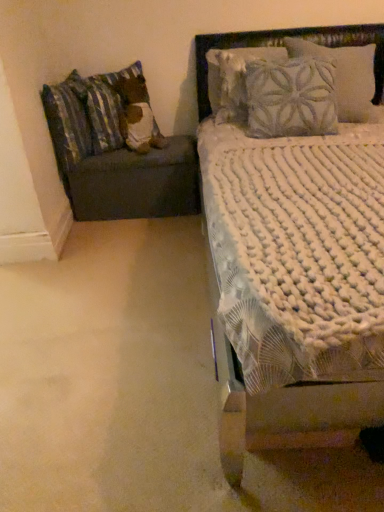
Identify the location of dark gray fabric ottoman at left. The image size is (384, 512). click(137, 183).

This screenshot has height=512, width=384. I want to click on striped fabric pillow at left, placed as the 2th pillow when sorted from right to left, so click(68, 121).

Image resolution: width=384 pixels, height=512 pixels. Find the location of `fluffy fabric pillow at left, which is counted as the second pillow, starting from the left`. fluffy fabric pillow at left, which is counted as the second pillow, starting from the left is located at coordinates (138, 116).

What do you see at coordinates (138, 116) in the screenshot? The width and height of the screenshot is (384, 512). I see `fluffy fabric pillow at left, which is counted as the second pillow, starting from the left` at bounding box center [138, 116].

Locate an element on the screen. The height and width of the screenshot is (512, 384). white textured bed at upper right is located at coordinates (282, 45).

Image resolution: width=384 pixels, height=512 pixels. What are the coordinates of `dark gray fabric ottoman at left` in the screenshot? It's located at (137, 183).

Is striped fabric pillow at left, the 1th pillow positioned from the left, at the back of fluffy fabric headboard at upper right?

No, fluffy fabric headboard at upper right is not facing the opposite direction of striped fabric pillow at left, the 1th pillow positioned from the left.

Who is more distant, fluffy fabric headboard at upper right or striped fabric pillow at left, placed as the 2th pillow when sorted from right to left?

Positioned behind is fluffy fabric headboard at upper right.

From the image's perspective, is fluffy fabric headboard at upper right on top of striped fabric pillow at left, the 1th pillow positioned from the left?

Yes, from the image's perspective, fluffy fabric headboard at upper right is over striped fabric pillow at left, the 1th pillow positioned from the left.

What's the angular difference between white textured bed at upper right and fluffy fabric pillow at left, which is counted as the second pillow, starting from the left,'s facing directions?

white textured bed at upper right and fluffy fabric pillow at left, which is counted as the second pillow, starting from the left, are facing 37.1 degrees away from each other.

Which object is further away from the camera, white textured bed at upper right or fluffy fabric pillow at left, which is counted as the second pillow, starting from the left?

fluffy fabric pillow at left, which is counted as the second pillow, starting from the left, is further away from the camera.

From a real-world perspective, which object stands above the other?

From a 3D spatial view, fluffy fabric pillow at left, the 1th pillow positioned from the right, is above.

At what (x,y) coordinates should I click in order to perform the action: click on table below the striped fabric pillow at left, placed as the 2th pillow when sorted from right to left (from the image's perspective). Please return your answer as a coordinate pair (x, y). The image size is (384, 512). Looking at the image, I should click on (137, 183).

Can you confirm if dark gray fabric ottoman at left is thinner than striped fabric pillow at left, the 1th pillow positioned from the left?

Incorrect, the width of dark gray fabric ottoman at left is not less than that of striped fabric pillow at left, the 1th pillow positioned from the left.

How many degrees apart are the facing directions of dark gray fabric ottoman at left and striped fabric pillow at left, the 1th pillow positioned from the left?

The facing directions of dark gray fabric ottoman at left and striped fabric pillow at left, the 1th pillow positioned from the left, are 79.7 degrees apart.

From the image's perspective, relative to striped fabric pillow at left, placed as the 2th pillow when sorted from right to left, is dark gray fabric ottoman at left above or below?

Clearly, from the image's perspective, dark gray fabric ottoman at left is below striped fabric pillow at left, placed as the 2th pillow when sorted from right to left.

The width and height of the screenshot is (384, 512). I want to click on pillow behind the striped fabric pillow at left, the 1th pillow positioned from the left, so click(x=138, y=116).

Measure the distance between fluffy fabric pillow at left, which is counted as the second pillow, starting from the left, and striped fabric pillow at left, placed as the 2th pillow when sorted from right to left.

fluffy fabric pillow at left, which is counted as the second pillow, starting from the left, is 11.36 inches from striped fabric pillow at left, placed as the 2th pillow when sorted from right to left.

Could you tell me if fluffy fabric pillow at left, which is counted as the second pillow, starting from the left, is turned towards striped fabric pillow at left, placed as the 2th pillow when sorted from right to left?

No, fluffy fabric pillow at left, which is counted as the second pillow, starting from the left, is not oriented towards striped fabric pillow at left, placed as the 2th pillow when sorted from right to left.

From the image's perspective, does fluffy fabric pillow at left, the 1th pillow positioned from the right, appear higher than striped fabric pillow at left, the 1th pillow positioned from the left?

Yes.

Is white textured bed at upper right at the back of striped fabric pillow at left, placed as the 2th pillow when sorted from right to left?

No, striped fabric pillow at left, placed as the 2th pillow when sorted from right to left, is not facing the opposite direction of white textured bed at upper right.

Which is further, (53, 94) or (295, 396)?

Positioned behind is point (53, 94).

Which of these two, striped fabric pillow at left, placed as the 2th pillow when sorted from right to left, or white textured bed at upper right, is bigger?

Bigger between the two is white textured bed at upper right.

Is dark gray fabric ottoman at left inside or outside of white textured bed at upper right?

dark gray fabric ottoman at left is located beyond the bounds of white textured bed at upper right.

Considering the positions of objects dark gray fabric ottoman at left and white textured bed at upper right in the image provided, who is behind, dark gray fabric ottoman at left or white textured bed at upper right?

dark gray fabric ottoman at left is further from the camera.

Based on the photo, considering the positions of objects dark gray fabric ottoman at left and white textured bed at upper right in the image provided, who is more to the left, dark gray fabric ottoman at left or white textured bed at upper right?

Positioned to the left is dark gray fabric ottoman at left.

From the picture: What's the angular difference between dark gray fabric ottoman at left and white textured bed at upper right's facing directions?

The facing directions of dark gray fabric ottoman at left and white textured bed at upper right are 0.392 degrees apart.

Locate an element on the screen. headboard on the left of white textured bed at upper right is located at coordinates coord(277,45).

Looking at the image, does white textured bed at upper right seem bigger or smaller compared to fluffy fabric headboard at upper right?

Considering their sizes, white textured bed at upper right takes up more space than fluffy fabric headboard at upper right.

Considering the points (252, 413) and (304, 38), which point is behind, point (252, 413) or point (304, 38)?

The point (304, 38) is farther.

Would you say white textured bed at upper right is outside fluffy fabric headboard at upper right?

That's correct, white textured bed at upper right is outside of fluffy fabric headboard at upper right.

This screenshot has height=512, width=384. I want to click on the 2nd pillow in front of the fluffy fabric headboard at upper right, counting from the anchor's position, so click(x=68, y=121).

Where is `the 2nd pillow above the white textured bed at upper right (from a real-world perspective)`? This screenshot has width=384, height=512. the 2nd pillow above the white textured bed at upper right (from a real-world perspective) is located at coordinates (138, 116).

Looking at the image, which one is located closer to striped fabric pillow at left, placed as the 2th pillow when sorted from right to left, dark gray fabric ottoman at left or white textured bed at upper right?

Among the two, dark gray fabric ottoman at left is located nearer to striped fabric pillow at left, placed as the 2th pillow when sorted from right to left.

Looking at the image, which one is located closer to white textured bed at upper right, striped fabric pillow at left, placed as the 2th pillow when sorted from right to left, or fluffy fabric headboard at upper right?

fluffy fabric headboard at upper right.

From the picture: Estimate the real-world distances between objects in this image. Which object is further from fluffy fabric headboard at upper right, dark gray fabric ottoman at left or striped fabric pillow at left, the 1th pillow positioned from the left?

Based on the image, striped fabric pillow at left, the 1th pillow positioned from the left, appears to be further to fluffy fabric headboard at upper right.

When comparing their distances from striped fabric pillow at left, placed as the 2th pillow when sorted from right to left, does fluffy fabric headboard at upper right or fluffy fabric pillow at left, the 1th pillow positioned from the right, seem further?

The object further to striped fabric pillow at left, placed as the 2th pillow when sorted from right to left, is fluffy fabric headboard at upper right.

Which object lies nearer to the anchor point fluffy fabric headboard at upper right, fluffy fabric pillow at left, which is counted as the second pillow, starting from the left, or dark gray fabric ottoman at left?

fluffy fabric pillow at left, which is counted as the second pillow, starting from the left.

Considering their positions, is striped fabric pillow at left, the 1th pillow positioned from the left, positioned closer to fluffy fabric headboard at upper right than white textured bed at upper right?

The object closer to fluffy fabric headboard at upper right is white textured bed at upper right.

When comparing their distances from striped fabric pillow at left, the 1th pillow positioned from the left, does fluffy fabric headboard at upper right or dark gray fabric ottoman at left seem further?

fluffy fabric headboard at upper right is further to striped fabric pillow at left, the 1th pillow positioned from the left.

Considering their positions, is fluffy fabric pillow at left, which is counted as the second pillow, starting from the left, positioned closer to fluffy fabric headboard at upper right than white textured bed at upper right?

white textured bed at upper right is positioned closer to the anchor fluffy fabric headboard at upper right.

This screenshot has height=512, width=384. I want to click on pillow between white textured bed at upper right and fluffy fabric pillow at left, the 1th pillow positioned from the right, from front to back, so click(x=68, y=121).

Identify the location of pillow between striped fabric pillow at left, placed as the 2th pillow when sorted from right to left, and fluffy fabric headboard at upper right from left to right. (138, 116).

The image size is (384, 512). I want to click on headboard between white textured bed at upper right and dark gray fabric ottoman at left along the z-axis, so [x=277, y=45].

The width and height of the screenshot is (384, 512). I want to click on table between striped fabric pillow at left, placed as the 2th pillow when sorted from right to left, and fluffy fabric pillow at left, the 1th pillow positioned from the right, in the horizontal direction, so click(x=137, y=183).